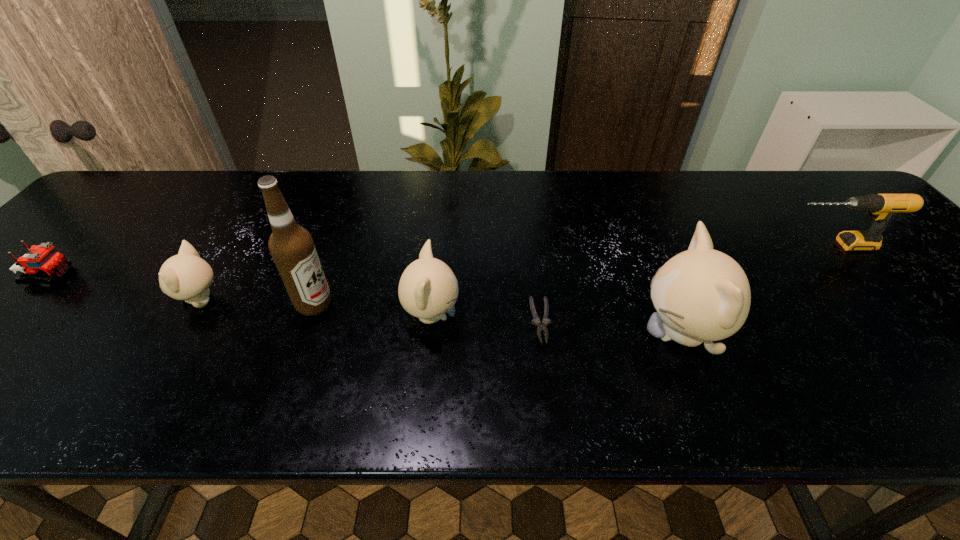
Where is `blank space at the near edge`? The width and height of the screenshot is (960, 540). blank space at the near edge is located at coordinates (197, 366).

The width and height of the screenshot is (960, 540). In the image, there is a desktop. Identify the location of vacant space at the left edge. (29, 289).

This screenshot has width=960, height=540. I want to click on vacant space at the right edge of the desktop, so click(x=952, y=291).

In the image, there is a desktop. Identify the location of vacant region at the far left corner. point(116,200).

Where is `vacant area at the far right corner`? vacant area at the far right corner is located at coordinates (792, 187).

Locate an element on the screen. The height and width of the screenshot is (540, 960). free space between the third object from right to left and the sixth object from right to left is located at coordinates (371, 310).

Find the location of a particular element. The width and height of the screenshot is (960, 540). empty location between the farthest object and the rightmost kitten is located at coordinates (756, 289).

Find the location of `free space between the tallest kitten and the tallest object`. free space between the tallest kitten and the tallest object is located at coordinates (497, 319).

I want to click on free point between the farthest object and the leftmost object, so tap(443, 261).

This screenshot has height=540, width=960. I want to click on empty space between the tallest kitten and the second shortest object, so click(x=366, y=305).